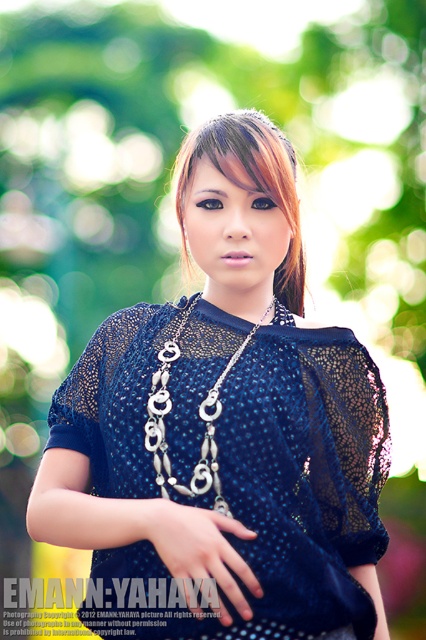
You are a photographer adjusting the camera focus. You need to ensure both the brown shiny hair at center and the silver metallic chain at center are in focus. Given their widths, which object should you prioritize focusing on first to ensure it fits within the frame?

The brown shiny hair at center is wider than the silver metallic chain at center, so you should prioritize focusing on the brown shiny hair at center first to ensure it fits within the frame.

You are a photographer adjusting the focus on your camera. The subject is wearing a matte blue blouse at center and a silver metallic chain at center. If you want to ensure both items are in focus simultaneously, what is the minimum distance the camera should be set to focus at?

The matte blue blouse at center and silver metallic chain at center are 9.83 inches apart from each other. To ensure both are in focus, the camera should be set to a focus distance that accommodates this separation, typically requiring a smaller aperture for a deeper depth of field.

The person in the image is wearing a matte blue blouse at center and has brown shiny hair at center. Which item is positioned lower on their body?

The matte blue blouse at center is below brown shiny hair at center, so the blouse is positioned lower than the hair.